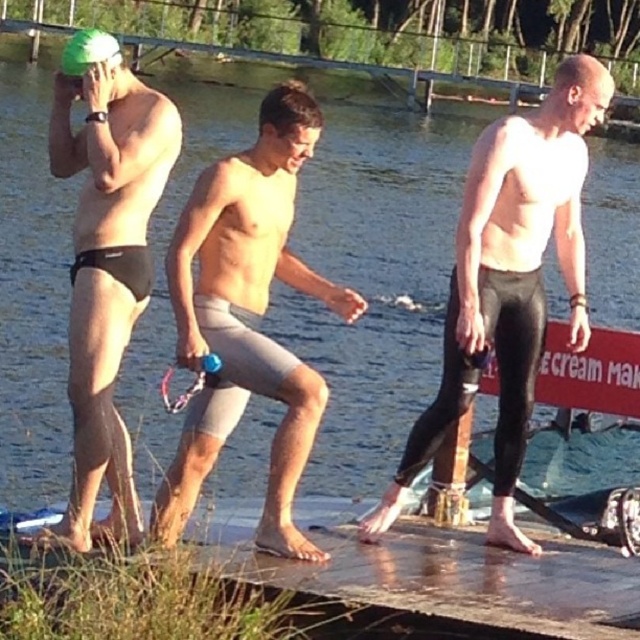
You are designing a new swimsuit collection and need to compare the sizes of the gray matte shorts at center and the green matte swim cap at upper left. Which item has a smaller width?

The gray matte shorts at center has a smaller width than the green matte swim cap at upper left according to the description.

You are designing a layout for a poster and need to place the wooden at center and the black matte swim cap at upper left next to each other. Considering their widths, which object should be placed first to ensure they fit properly?

The wooden at center has a greater width than the black matte swim cap at upper left, so place the wooden at center first to accommodate its larger size.